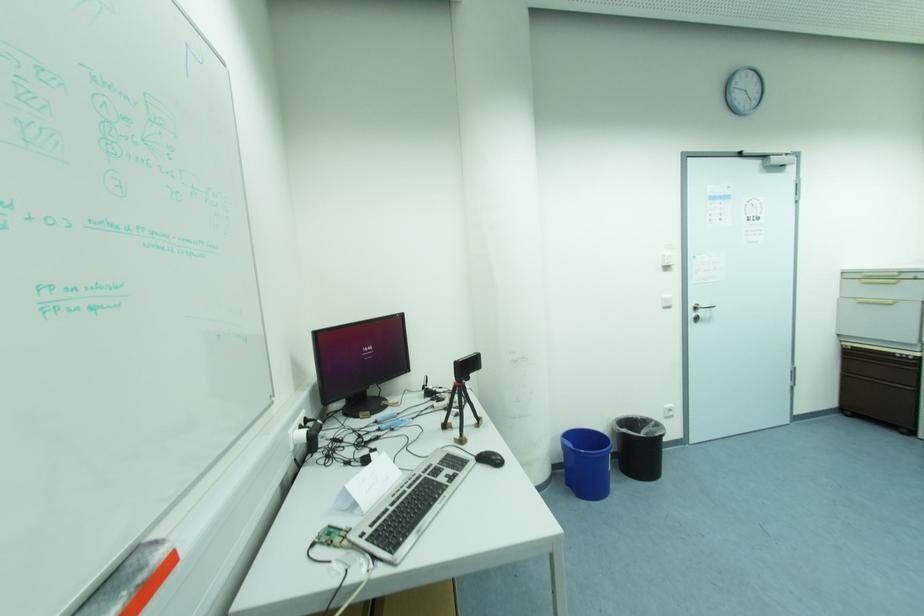
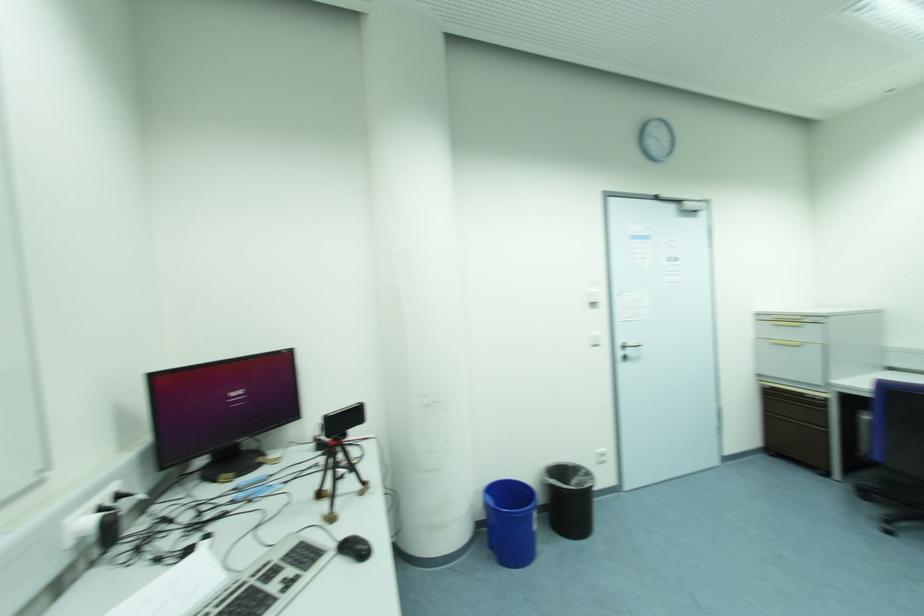
Question: The first image is from the beginning of the video and the second image is from the end. How did the camera likely rotate when shooting the video?

Choices:
 (A) Left
 (B) Right
 (C) Up
 (D) Down

Answer: (B)